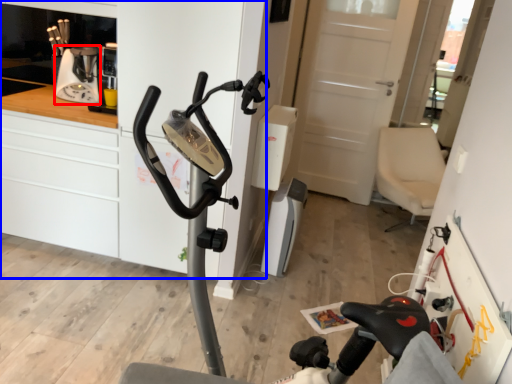
Question: Which point is further to the camera, coffee machine (highlighted by a red box) or dresser (highlighted by a blue box)?

Choices:
 (A) coffee machine
 (B) dresser

Answer: (A)